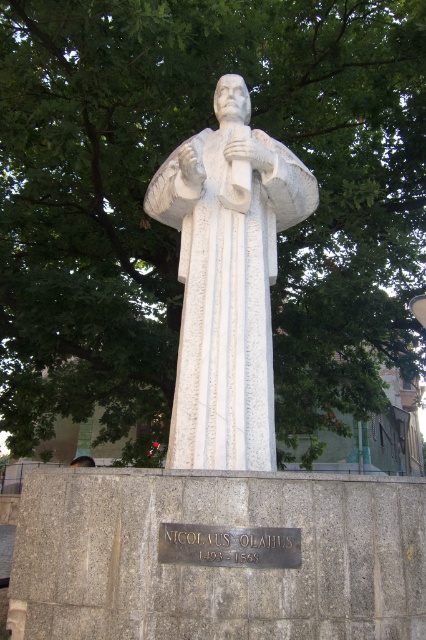
Question: Estimate the real-world distances between objects in this image. Which object is closer to the brown leather hat at lower left?

Choices:
 (A) green leafy tree at upper center
 (B) white marble statue at center

Answer: (A)

Question: Does white marble statue at center appear under brown leather hat at lower left?

Choices:
 (A) no
 (B) yes

Answer: (A)

Question: Which of the following is the farthest from the observer?

Choices:
 (A) (72, 460)
 (B) (103, 289)

Answer: (A)

Question: Is white marble statue at center thinner than brown leather hat at lower left?

Choices:
 (A) yes
 (B) no

Answer: (B)

Question: Which object is positioned farthest from the green leafy tree at upper center?

Choices:
 (A) brown leather hat at lower left
 (B) white marble statue at center

Answer: (B)

Question: Does green leafy tree at upper center appear over brown leather hat at lower left?

Choices:
 (A) yes
 (B) no

Answer: (A)